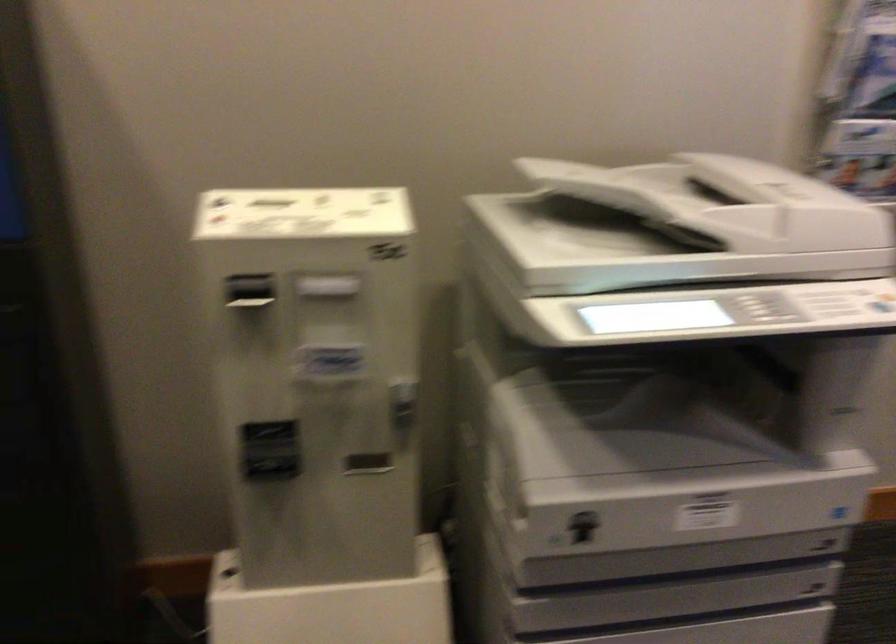
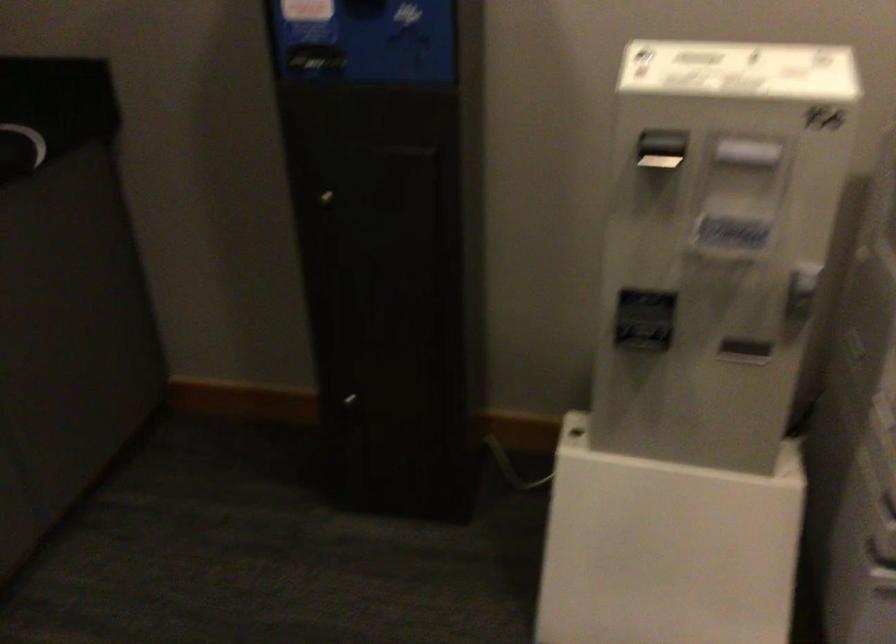
Question: Based on the continuous images, in which direction is the camera rotating? Reply with the corresponding letter.

Choices:
 (A) Left
 (B) Right
 (C) Up
 (D) Down

Answer: (A)